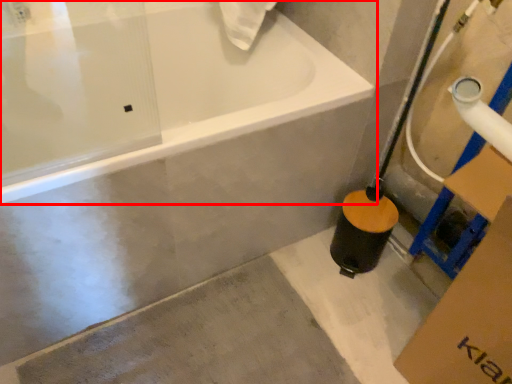
Question: From the image's perspective, where is bathtub (annotated by the red box) located relative to concrete?

Choices:
 (A) below
 (B) above

Answer: (B)